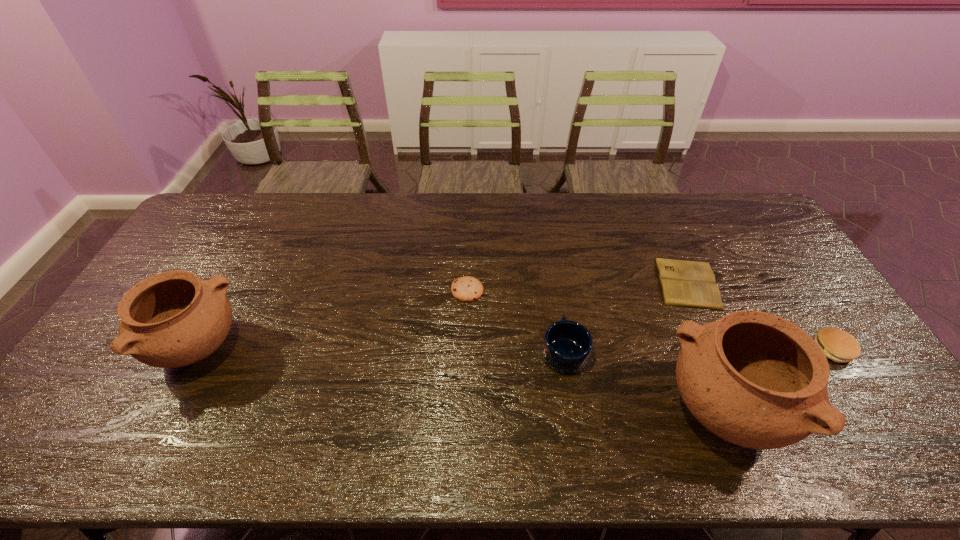
Find the location of `the third tallest object`. the third tallest object is located at coordinates (567, 345).

Locate an element on the screen. The image size is (960, 540). free spot located on the right of the shorter pottery is located at coordinates (282, 349).

Where is `free point located on the back of the taller pottery`? This screenshot has height=540, width=960. free point located on the back of the taller pottery is located at coordinates (679, 302).

Find the location of a particular element. free region located 0.220m on the left of the shortest object is located at coordinates (587, 283).

You are a GUI agent. You are given a task and a screenshot of the screen. Output one action in this format:
    pyautogui.click(x=<x>, y=<y>)
    Task: Click on the free region located on the left of the fourth tallest object
    Image resolution: width=960 pixels, height=540 pixels.
    Given the screenshot: What is the action you would take?
    pyautogui.click(x=708, y=349)

Locate an element on the screen. vacant region located on the left of the fifth object from right to left is located at coordinates (373, 291).

Where is `free space located with the handle on the side of the third object from left to right`? Image resolution: width=960 pixels, height=540 pixels. free space located with the handle on the side of the third object from left to right is located at coordinates (548, 247).

Image resolution: width=960 pixels, height=540 pixels. What are the coordinates of `vacant space positioned with the handle on the side of the third object from left to right` in the screenshot? It's located at (550, 261).

Where is `free space located 0.180m with the handle on the side of the third object from left to right`? The height and width of the screenshot is (540, 960). free space located 0.180m with the handle on the side of the third object from left to right is located at coordinates (554, 283).

Find the location of a particular element. This screenshot has height=540, width=960. object present at the left edge is located at coordinates (172, 319).